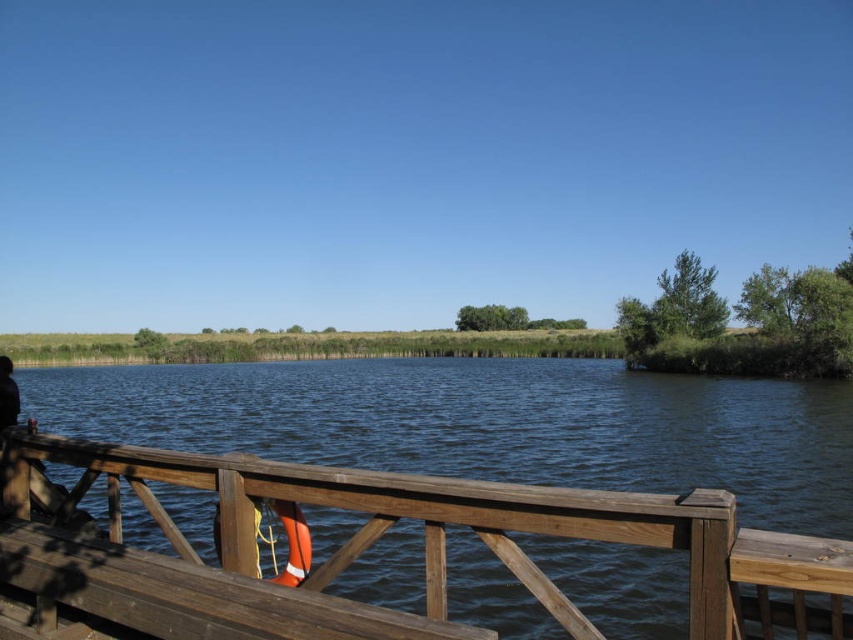
Question: Is brown wooden rail at lower center above orange fabric life jacket at lower center?

Choices:
 (A) no
 (B) yes

Answer: (B)

Question: Observing the image, what is the correct spatial positioning of brown wooden rail at lower center in reference to orange fabric life jacket at lower center?

Choices:
 (A) above
 (B) below

Answer: (A)

Question: Which point is closer to the camera?

Choices:
 (A) orange fabric life jacket at lower center
 (B) brown wooden rail at lower center

Answer: (B)

Question: Is brown wooden rail at lower center further to camera compared to orange fabric life jacket at lower center?

Choices:
 (A) yes
 (B) no

Answer: (B)